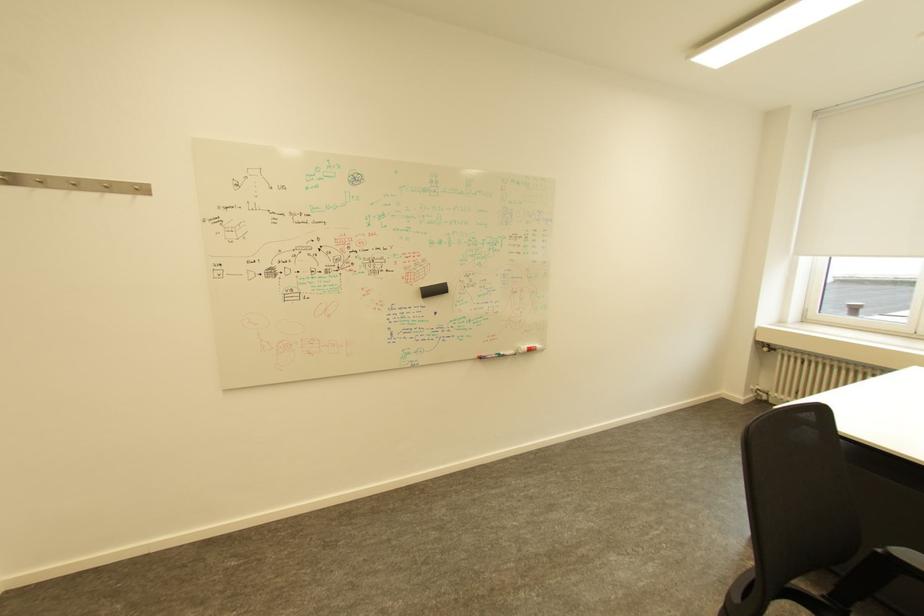
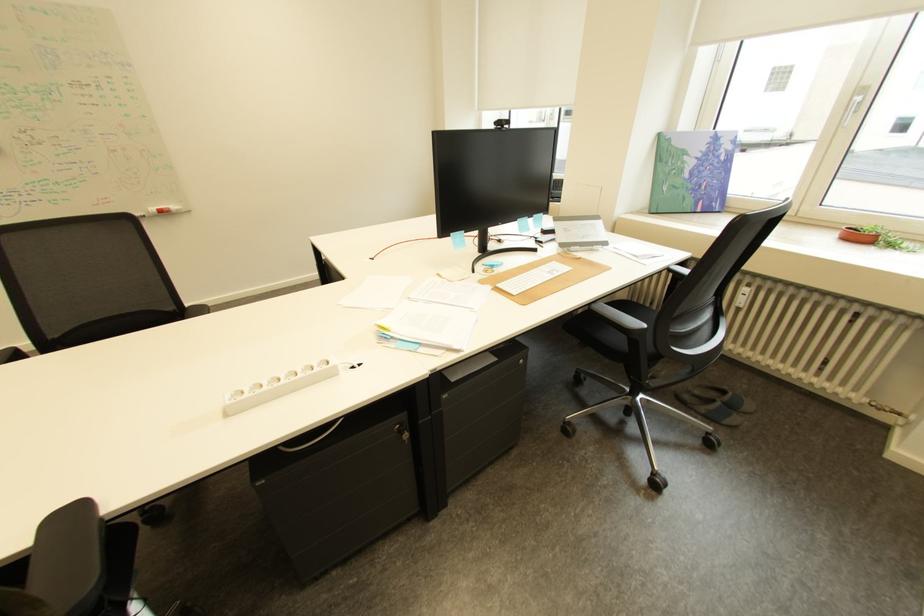
Question: Which direction would the cameraman need to move to produce the second image? Reply with the corresponding letter.

Choices:
 (A) Left
 (B) Right
 (C) Forward
 (D) Backward

Answer: (B)